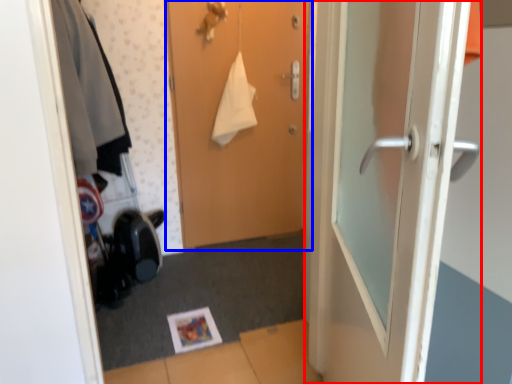
Question: Which point is further to the camera, door (highlighted by a red box) or door (highlighted by a blue box)?

Choices:
 (A) door
 (B) door

Answer: (B)